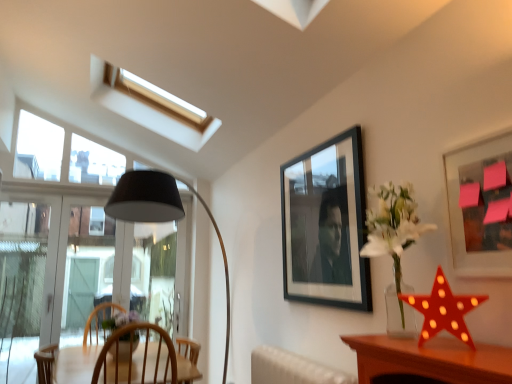
Locate an element on the screen. The width and height of the screenshot is (512, 384). transparent glass window at left is located at coordinates (86, 250).

This screenshot has height=384, width=512. What do you see at coordinates (481, 207) in the screenshot? I see `matte black picture frame at upper right, positioned as the second picture frame in left-to-right order` at bounding box center [481, 207].

I want to click on black matte picture frame at upper center, which is the 2th picture frame from right to left, so pos(326,225).

Where is `transparent glass window at left`? The width and height of the screenshot is (512, 384). transparent glass window at left is located at coordinates (86, 250).

Who is smaller, red plastic star at right or black matte picture frame at upper center, placed as the first picture frame when sorted from back to front?

red plastic star at right is smaller.

Consider the image. From the image's perspective, is red plastic star at right above or below black matte picture frame at upper center, which is the 2th picture frame from right to left?

red plastic star at right is below black matte picture frame at upper center, which is the 2th picture frame from right to left.

Is red plastic star at right inside the boundaries of black matte picture frame at upper center, which is the 2th picture frame from right to left, or outside?

red plastic star at right is located beyond the bounds of black matte picture frame at upper center, which is the 2th picture frame from right to left.

From a real-world perspective, relative to black matte picture frame at upper center, which is counted as the 1th picture frame, starting from the left, is red plastic star at right vertically above or below?

red plastic star at right is situated lower than black matte picture frame at upper center, which is counted as the 1th picture frame, starting from the left, in the real world.

From the image's perspective, is transparent glass window at left positioned above or below red plastic star at right?

Clearly, from the image's perspective, transparent glass window at left is below red plastic star at right.

Is transparent glass window at left aimed at red plastic star at right?

Yes, transparent glass window at left is oriented towards red plastic star at right.

Is transparent glass window at left touching red plastic star at right?

No.

Does point (501, 207) lie in front of point (286, 201)?

That is True.

Considering the sizes of matte black picture frame at upper right, positioned as the 1th picture frame in right-to-left order, and black matte picture frame at upper center, which is the 2th picture frame from right to left, in the image, is matte black picture frame at upper right, positioned as the 1th picture frame in right-to-left order, taller or shorter than black matte picture frame at upper center, which is the 2th picture frame from right to left,?

matte black picture frame at upper right, positioned as the 1th picture frame in right-to-left order, is shorter than black matte picture frame at upper center, which is the 2th picture frame from right to left.

Could you tell me if matte black picture frame at upper right, which is counted as the 1th picture frame, starting from the front, is turned towards black matte picture frame at upper center, arranged as the 2th picture frame when viewed from the front?

No, matte black picture frame at upper right, which is counted as the 1th picture frame, starting from the front, is not oriented towards black matte picture frame at upper center, arranged as the 2th picture frame when viewed from the front.

Would you say matte black picture frame at upper right, positioned as the second picture frame in left-to-right order, is a long distance from black matte picture frame at upper center, placed as the first picture frame when sorted from back to front?

That's not correct — matte black picture frame at upper right, positioned as the second picture frame in left-to-right order, is a little close to black matte picture frame at upper center, placed as the first picture frame when sorted from back to front.

Which is behind, point (287, 271) or point (11, 198)?

The point (11, 198) is more distant.

Choose the correct answer: Is black matte picture frame at upper center, arranged as the 2th picture frame when viewed from the front, inside transparent glass window at left or outside it?

black matte picture frame at upper center, arranged as the 2th picture frame when viewed from the front, lies outside transparent glass window at left.

Between black matte picture frame at upper center, which is the 2th picture frame from right to left, and transparent glass window at left, which one has larger width?

With larger width is transparent glass window at left.

From the image's perspective, which object appears higher, black matte picture frame at upper center, placed as the first picture frame when sorted from back to front, or transparent glass window at left?

black matte picture frame at upper center, placed as the first picture frame when sorted from back to front, from the image's perspective.

Is black matte picture frame at upper center, which is counted as the 1th picture frame, starting from the left, spatially inside matte black picture frame at upper right, which appears as the second picture frame when viewed from the back, or outside of it?

black matte picture frame at upper center, which is counted as the 1th picture frame, starting from the left, is outside matte black picture frame at upper right, which appears as the second picture frame when viewed from the back.

From the image's perspective, relative to matte black picture frame at upper right, positioned as the 1th picture frame in right-to-left order, is black matte picture frame at upper center, which is counted as the 1th picture frame, starting from the left, above or below?

black matte picture frame at upper center, which is counted as the 1th picture frame, starting from the left, is below matte black picture frame at upper right, positioned as the 1th picture frame in right-to-left order.

Is black matte picture frame at upper center, placed as the first picture frame when sorted from back to front, next to matte black picture frame at upper right, positioned as the second picture frame in left-to-right order?

There is a gap between black matte picture frame at upper center, placed as the first picture frame when sorted from back to front, and matte black picture frame at upper right, positioned as the second picture frame in left-to-right order.

Which is more to the right, red plastic star at right or transparent glass window at left?

From the viewer's perspective, red plastic star at right appears more on the right side.

In terms of width, does red plastic star at right look wider or thinner when compared to transparent glass window at left?

red plastic star at right is wider than transparent glass window at left.

Is red plastic star at right facing towards transparent glass window at left?

No, red plastic star at right is not aimed at transparent glass window at left.

From the image's perspective, is red plastic star at right under transparent glass window at left?

Actually, red plastic star at right appears above transparent glass window at left in the image.

Who is bigger, black matte picture frame at upper center, placed as the first picture frame when sorted from back to front, or red plastic star at right?

With larger size is black matte picture frame at upper center, placed as the first picture frame when sorted from back to front.

Is black matte picture frame at upper center, arranged as the 2th picture frame when viewed from the front, looking in the opposite direction of red plastic star at right?

That's not correct — black matte picture frame at upper center, arranged as the 2th picture frame when viewed from the front, is not looking away from red plastic star at right.

Is black matte picture frame at upper center, arranged as the 2th picture frame when viewed from the front, outside of red plastic star at right?

Yes, black matte picture frame at upper center, arranged as the 2th picture frame when viewed from the front, is not within red plastic star at right.

Which is more distant, (323, 240) or (467, 303)?

The point (323, 240) is more distant.

There is a red plastic star at right. Identify the location of the 2nd picture frame above it (from a real-world perspective). (326, 225).

This screenshot has height=384, width=512. I want to click on star on the right of transparent glass window at left, so click(443, 310).

From the image, which object appears to be nearer to red plastic star at right, black matte picture frame at upper center, arranged as the 2th picture frame when viewed from the front, or transparent glass window at left?

Based on the image, black matte picture frame at upper center, arranged as the 2th picture frame when viewed from the front, appears to be nearer to red plastic star at right.

When comparing their distances from red plastic star at right, does transparent glass window at left or black matte picture frame at upper center, placed as the first picture frame when sorted from back to front, seem closer?

black matte picture frame at upper center, placed as the first picture frame when sorted from back to front, lies closer to red plastic star at right than the other object.

Which object lies nearer to the anchor point red plastic star at right, transparent glass window at left or matte black picture frame at upper right, which appears as the second picture frame when viewed from the back?

matte black picture frame at upper right, which appears as the second picture frame when viewed from the back, is positioned closer to the anchor red plastic star at right.

Considering their positions, is transparent glass window at left positioned closer to matte black picture frame at upper right, which appears as the second picture frame when viewed from the back, than red plastic star at right?

Among the two, red plastic star at right is located nearer to matte black picture frame at upper right, which appears as the second picture frame when viewed from the back.

Considering their positions, is transparent glass window at left positioned closer to black matte picture frame at upper center, which is the 2th picture frame from right to left, than red plastic star at right?

red plastic star at right is positioned closer to the anchor black matte picture frame at upper center, which is the 2th picture frame from right to left.

Considering their positions, is red plastic star at right positioned further to black matte picture frame at upper center, arranged as the 2th picture frame when viewed from the front, than transparent glass window at left?

transparent glass window at left lies further to black matte picture frame at upper center, arranged as the 2th picture frame when viewed from the front, than the other object.

Estimate the real-world distances between objects in this image. Which object is further from matte black picture frame at upper right, positioned as the 1th picture frame in right-to-left order, black matte picture frame at upper center, which is counted as the 1th picture frame, starting from the left, or red plastic star at right?

black matte picture frame at upper center, which is counted as the 1th picture frame, starting from the left, lies further to matte black picture frame at upper right, positioned as the 1th picture frame in right-to-left order, than the other object.

Which object lies further to the anchor point matte black picture frame at upper right, which is counted as the 1th picture frame, starting from the front, red plastic star at right or transparent glass window at left?

Based on the image, transparent glass window at left appears to be further to matte black picture frame at upper right, which is counted as the 1th picture frame, starting from the front.

Identify the location of star positioned between matte black picture frame at upper right, which is counted as the 1th picture frame, starting from the front, and black matte picture frame at upper center, arranged as the 2th picture frame when viewed from the front, from near to far. The width and height of the screenshot is (512, 384). (443, 310).

Where is `picture frame located between matte black picture frame at upper right, which is counted as the 1th picture frame, starting from the front, and transparent glass window at left in the depth direction`? picture frame located between matte black picture frame at upper right, which is counted as the 1th picture frame, starting from the front, and transparent glass window at left in the depth direction is located at coordinates (326, 225).

Find the location of a particular element. picture frame between red plastic star at right and transparent glass window at left from front to back is located at coordinates (326, 225).

Where is `star between matte black picture frame at upper right, positioned as the 1th picture frame in right-to-left order, and transparent glass window at left from front to back`? star between matte black picture frame at upper right, positioned as the 1th picture frame in right-to-left order, and transparent glass window at left from front to back is located at coordinates (443, 310).